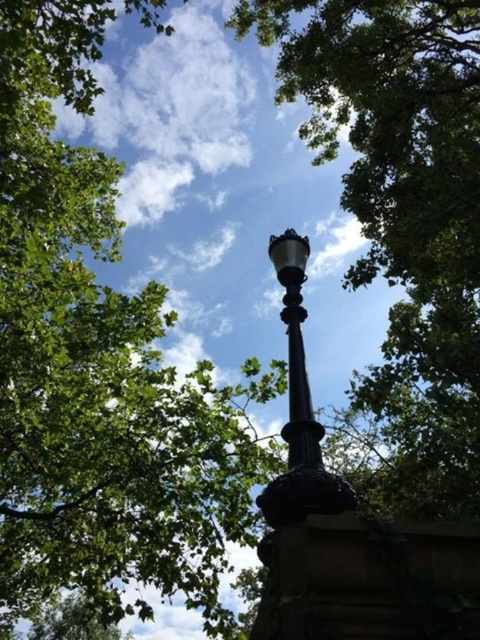
Between polished black lamppost at upper center and black polished metal pole at center, which one appears on the left side from the viewer's perspective?

From the viewer's perspective, black polished metal pole at center appears more on the left side.

Between point (311, 513) and point (312, 436), which one is positioned behind?

The point (312, 436) is behind.

This screenshot has width=480, height=640. What do you see at coordinates (299, 410) in the screenshot?
I see `polished black lamppost at upper center` at bounding box center [299, 410].

Find the location of a particular element. polished black lamppost at upper center is located at coordinates (299, 410).